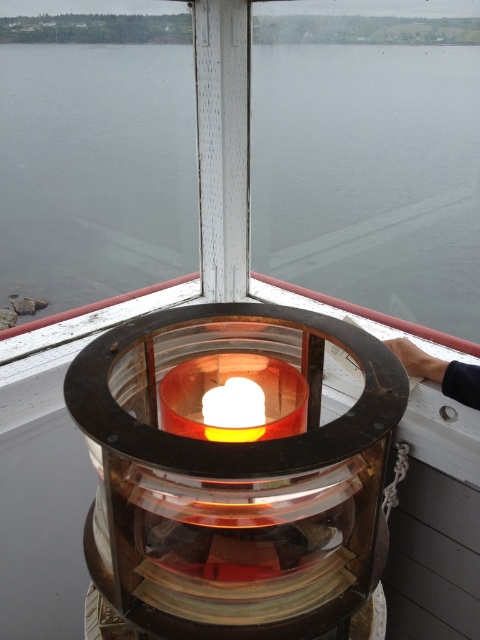
Question: Can you confirm if translucent amber glass at center is positioned below smooth skin hand at upper right?

Choices:
 (A) yes
 (B) no

Answer: (A)

Question: Estimate the real-world distances between objects in this image. Which object is closer to the smooth skin hand at upper right?

Choices:
 (A) translucent amber glass at center
 (B) transparent glass water at center

Answer: (A)

Question: Does transparent glass water at center have a larger size compared to translucent amber glass at center?

Choices:
 (A) yes
 (B) no

Answer: (A)

Question: Which of the following is the farthest from the observer?

Choices:
 (A) transparent glass water at center
 (B) smooth skin hand at upper right
 (C) translucent glass candle at center
 (D) translucent amber glass at center

Answer: (A)

Question: Is translucent glass candle at center further to camera compared to smooth skin hand at upper right?

Choices:
 (A) no
 (B) yes

Answer: (A)

Question: Estimate the real-world distances between objects in this image. Which object is farther from the translucent glass candle at center?

Choices:
 (A) transparent glass water at center
 (B) smooth skin hand at upper right

Answer: (A)